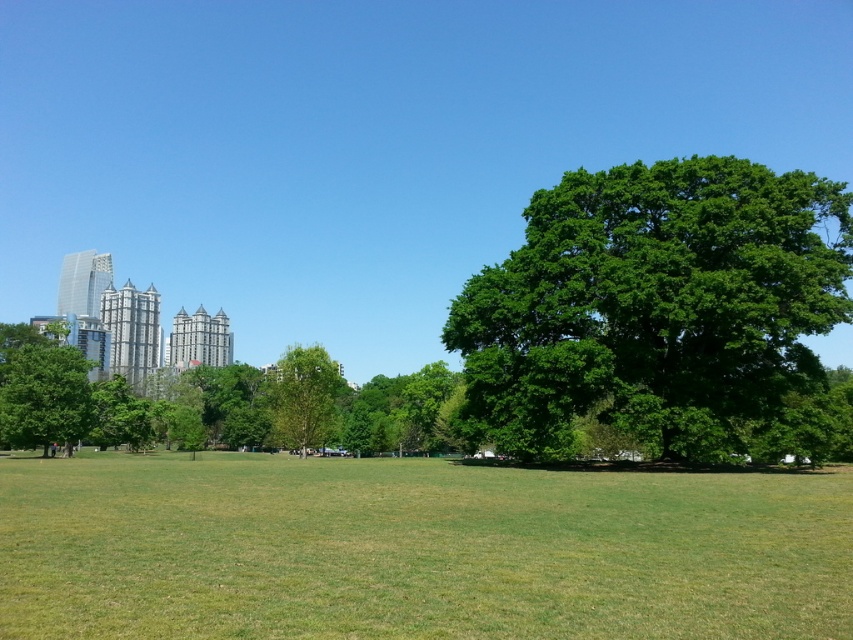
Which is more to the right, green leafy tree at right or green leafy tree at left?

green leafy tree at right is more to the right.

Which is behind, point (572, 234) or point (77, 390)?

Point (77, 390)

Identify the location of green leafy tree at right. (656, 307).

Is green leafy tree at left bigger than green leafy tree at center?

No, green leafy tree at left is not bigger than green leafy tree at center.

Is point (41, 394) farther from viewer compared to point (276, 371)?

No.

Where is `green leafy tree at left`? The image size is (853, 640). green leafy tree at left is located at coordinates (44, 396).

Is point (752, 595) positioned behind point (323, 388)?

That is False.

Consider the image. Does green grass at center have a greater height compared to green leafy tree at center?

No.

Is point (575, 500) closer to viewer compared to point (300, 401)?

That is True.

Where is `green grass at center`? This screenshot has width=853, height=640. green grass at center is located at coordinates (415, 548).